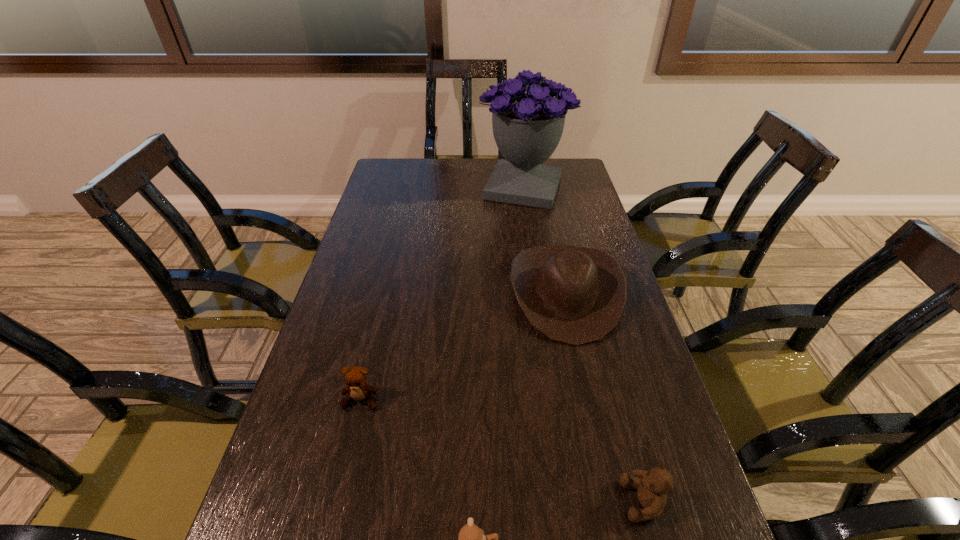
Locate an element on the screen. The width and height of the screenshot is (960, 540). vacant area at the far edge is located at coordinates (498, 162).

Locate an element on the screen. free region at the left edge of the desktop is located at coordinates (400, 219).

Where is `vacant space at the right edge of the desktop`? Image resolution: width=960 pixels, height=540 pixels. vacant space at the right edge of the desktop is located at coordinates [617, 526].

Image resolution: width=960 pixels, height=540 pixels. Identify the location of free space at the far left corner. (376, 184).

The width and height of the screenshot is (960, 540). Identify the location of free location at the far right corner. (572, 178).

Locate an element on the screen. This screenshot has height=540, width=960. vacant area between the cowboy hat and the farthest teddy bear is located at coordinates (463, 347).

The width and height of the screenshot is (960, 540). I want to click on free space between the fourth shortest object and the bouquet, so click(544, 241).

What are the coordinates of `vacant space that is in between the farthest teddy bear and the cowboy hat` in the screenshot? It's located at (463, 347).

Identify the location of empty location between the third nearest object and the bouquet. The width and height of the screenshot is (960, 540). (442, 294).

The width and height of the screenshot is (960, 540). I want to click on vacant area between the cowboy hat and the leftmost object, so click(x=463, y=347).